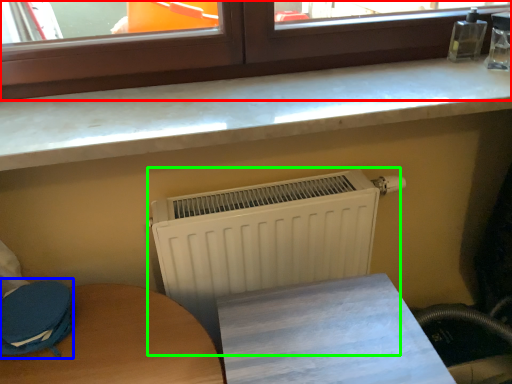
Question: Which object is positioned closest to window (highlighted by a red box)? Select from swivel chair (highlighted by a blue box) and radiator (highlighted by a green box).

Choices:
 (A) swivel chair
 (B) radiator

Answer: (B)